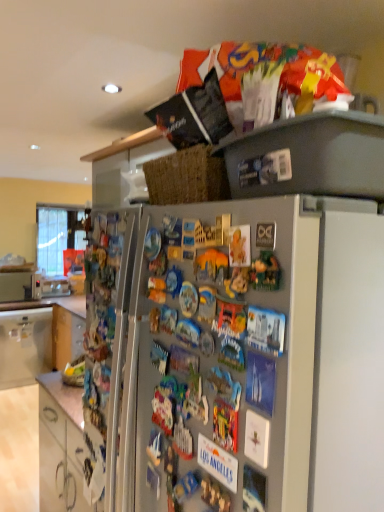
Locate an element on the screen. Image resolution: width=384 pixels, height=512 pixels. white glossy cabinet at lower left, which appears as the first cabinetry when viewed from the front is located at coordinates pyautogui.click(x=66, y=450).

Measure the distance between white glossy cabinet at lower left, positioned as the 2th cabinetry in back-to-front order, and camera.

The distance of white glossy cabinet at lower left, positioned as the 2th cabinetry in back-to-front order, from camera is 1.16 meters.

This screenshot has height=512, width=384. What do you see at coordinates (25, 346) in the screenshot?
I see `white glossy cabinet at lower left, which is counted as the first cabinetry, starting from the back` at bounding box center [25, 346].

Describe the element at coordinates (256, 359) in the screenshot. I see `satin silver fridge at upper center` at that location.

I want to click on white glossy cabinet at lower left, which is the 1th cabinetry in bottom-to-top order, so click(x=66, y=450).

Is white glossy cabinet at lower left, which appears as the first cabinetry when viewed from the front, thinner than satin silver fridge at upper center?

No.

Image resolution: width=384 pixels, height=512 pixels. Identify the location of refrigerator that appears on the right of white glossy cabinet at lower left, acting as the second cabinetry starting from the top. (256, 359).

Can you confirm if white glossy cabinet at lower left, which appears as the first cabinetry when viewed from the front, is taller than satin silver fridge at upper center?

No, white glossy cabinet at lower left, which appears as the first cabinetry when viewed from the front, is not taller than satin silver fridge at upper center.

Is white glossy cabinet at lower left, which appears as the first cabinetry when viewed from the front, to the left or to the right of satin silver fridge at upper center in the image?

white glossy cabinet at lower left, which appears as the first cabinetry when viewed from the front, is to the left of satin silver fridge at upper center.

Considering the sizes of objects white glossy cabinet at lower left, which is counted as the second cabinetry, starting from the bottom, and white glossy cabinet at lower left, which appears as the first cabinetry when viewed from the front, in the image provided, who is thinner, white glossy cabinet at lower left, which is counted as the second cabinetry, starting from the bottom, or white glossy cabinet at lower left, which appears as the first cabinetry when viewed from the front,?

With smaller width is white glossy cabinet at lower left, which is counted as the second cabinetry, starting from the bottom.

The image size is (384, 512). In order to click on cabinetry below the white glossy cabinet at lower left, which is counted as the second cabinetry, starting from the bottom (from a real-world perspective) in this screenshot , I will do `click(66, 450)`.

Which object is more forward, white glossy cabinet at lower left, which is counted as the first cabinetry, starting from the back, or white glossy cabinet at lower left, positioned as the 2th cabinetry in back-to-front order?

white glossy cabinet at lower left, positioned as the 2th cabinetry in back-to-front order, is in front.

Can you confirm if satin silver fridge at upper center is smaller than metallic silver microwave at left?

No.

Considering the sizes of satin silver fridge at upper center and metallic silver microwave at left in the image, is satin silver fridge at upper center taller or shorter than metallic silver microwave at left?

In the image, satin silver fridge at upper center appears to be taller than metallic silver microwave at left.

Would you say satin silver fridge at upper center is a long distance from metallic silver microwave at left?

Yes, satin silver fridge at upper center and metallic silver microwave at left are quite far apart.

Is metallic silver microwave at left at the back of satin silver fridge at upper center?

No, metallic silver microwave at left is not at the back of satin silver fridge at upper center.

Is metallic silver microwave at left outside of white glossy cabinet at lower left, which is counted as the second cabinetry, starting from the bottom?

metallic silver microwave at left lies outside white glossy cabinet at lower left, which is counted as the second cabinetry, starting from the bottom,'s area.

Are metallic silver microwave at left and white glossy cabinet at lower left, which ranks as the first cabinetry in top-to-bottom order, beside each other?

No, metallic silver microwave at left is not beside white glossy cabinet at lower left, which ranks as the first cabinetry in top-to-bottom order.

Locate an element on the screen. the 1st cabinetry counting from the right side of the metallic silver microwave at left is located at coordinates (25, 346).

From a real-world perspective, between white glossy cabinet at lower left, which is counted as the first cabinetry, starting from the back, and satin silver fridge at upper center, who is vertically higher?

satin silver fridge at upper center.

Which is correct: white glossy cabinet at lower left, positioned as the second cabinetry in front-to-back order, is inside satin silver fridge at upper center, or outside of it?

white glossy cabinet at lower left, positioned as the second cabinetry in front-to-back order, is outside satin silver fridge at upper center.

Which is more to the left, white glossy cabinet at lower left, which is counted as the second cabinetry, starting from the bottom, or satin silver fridge at upper center?

From the viewer's perspective, white glossy cabinet at lower left, which is counted as the second cabinetry, starting from the bottom, appears more on the left side.

Is white glossy cabinet at lower left, which is counted as the second cabinetry, starting from the bottom, touching satin silver fridge at upper center?

No, white glossy cabinet at lower left, which is counted as the second cabinetry, starting from the bottom, is not next to satin silver fridge at upper center.

Does satin silver fridge at upper center appear on the left side of white glossy cabinet at lower left, which is counted as the second cabinetry, starting from the bottom?

Incorrect, satin silver fridge at upper center is not on the left side of white glossy cabinet at lower left, which is counted as the second cabinetry, starting from the bottom.

Do you think satin silver fridge at upper center is within white glossy cabinet at lower left, which is counted as the second cabinetry, starting from the bottom, or outside of it?

satin silver fridge at upper center is not enclosed by white glossy cabinet at lower left, which is counted as the second cabinetry, starting from the bottom.

Can you confirm if satin silver fridge at upper center is wider than white glossy cabinet at lower left, positioned as the second cabinetry in front-to-back order?

No.

Between white glossy cabinet at lower left, acting as the second cabinetry starting from the top, and white glossy cabinet at lower left, which is counted as the second cabinetry, starting from the bottom, which one has smaller size?

white glossy cabinet at lower left, acting as the second cabinetry starting from the top.

Choose the correct answer: Is white glossy cabinet at lower left, which is the 1th cabinetry in bottom-to-top order, inside white glossy cabinet at lower left, which ranks as the first cabinetry in top-to-bottom order, or outside it?

The correct answer is: outside.

Is point (72, 432) closer to camera compared to point (39, 348)?

Yes, it is.

Who is taller, white glossy cabinet at lower left, acting as the second cabinetry starting from the top, or white glossy cabinet at lower left, positioned as the second cabinetry in front-to-back order?

With more height is white glossy cabinet at lower left, positioned as the second cabinetry in front-to-back order.

Where is `cabinetry that is the 1st object to the left of the satin silver fridge at upper center, starting at the anchor`? cabinetry that is the 1st object to the left of the satin silver fridge at upper center, starting at the anchor is located at coordinates (66, 450).

You are a GUI agent. You are given a task and a screenshot of the screen. Output one action in this format:
    pyautogui.click(x=<x>, y=<y>)
    Task: Click on the cabinetry lying behind the white glossy cabinet at lower left, acting as the second cabinetry starting from the top
    
    Given the screenshot: What is the action you would take?
    pyautogui.click(x=25, y=346)

Looking at this image, looking at the image, which one is located closer to white glossy cabinet at lower left, positioned as the 2th cabinetry in back-to-front order, white glossy cabinet at lower left, positioned as the second cabinetry in front-to-back order, or metallic silver microwave at left?

white glossy cabinet at lower left, positioned as the second cabinetry in front-to-back order, is closer to white glossy cabinet at lower left, positioned as the 2th cabinetry in back-to-front order.

From the image, which object appears to be nearer to white glossy cabinet at lower left, which is the 1th cabinetry in bottom-to-top order, metallic silver microwave at left or white glossy cabinet at lower left, positioned as the second cabinetry in front-to-back order?

white glossy cabinet at lower left, positioned as the second cabinetry in front-to-back order.

When comparing their distances from metallic silver microwave at left, does satin silver fridge at upper center or white glossy cabinet at lower left, positioned as the 2th cabinetry in back-to-front order, seem further?

Based on the image, satin silver fridge at upper center appears to be further to metallic silver microwave at left.

Looking at the image, which one is located closer to white glossy cabinet at lower left, positioned as the 2th cabinetry in back-to-front order, satin silver fridge at upper center or white glossy cabinet at lower left, positioned as the second cabinetry in front-to-back order?

satin silver fridge at upper center.

Which object lies nearer to the anchor point white glossy cabinet at lower left, which is counted as the first cabinetry, starting from the back, satin silver fridge at upper center or metallic silver microwave at left?

metallic silver microwave at left.

Estimate the real-world distances between objects in this image. Which object is closer to metallic silver microwave at left, white glossy cabinet at lower left, which is counted as the second cabinetry, starting from the bottom, or satin silver fridge at upper center?

white glossy cabinet at lower left, which is counted as the second cabinetry, starting from the bottom.

Considering their positions, is white glossy cabinet at lower left, which is counted as the first cabinetry, starting from the back, positioned closer to satin silver fridge at upper center than white glossy cabinet at lower left, which is the 1th cabinetry in bottom-to-top order?

white glossy cabinet at lower left, which is the 1th cabinetry in bottom-to-top order.

When comparing their distances from satin silver fridge at upper center, does white glossy cabinet at lower left, which is counted as the first cabinetry, starting from the back, or metallic silver microwave at left seem further?

metallic silver microwave at left.

Locate an element on the screen. cabinetry between white glossy cabinet at lower left, positioned as the 2th cabinetry in back-to-front order, and metallic silver microwave at left, along the z-axis is located at coordinates (25, 346).

Find the location of `cabinetry located between satin silver fridge at upper center and white glossy cabinet at lower left, which is counted as the first cabinetry, starting from the back, in the depth direction`. cabinetry located between satin silver fridge at upper center and white glossy cabinet at lower left, which is counted as the first cabinetry, starting from the back, in the depth direction is located at coordinates (66, 450).